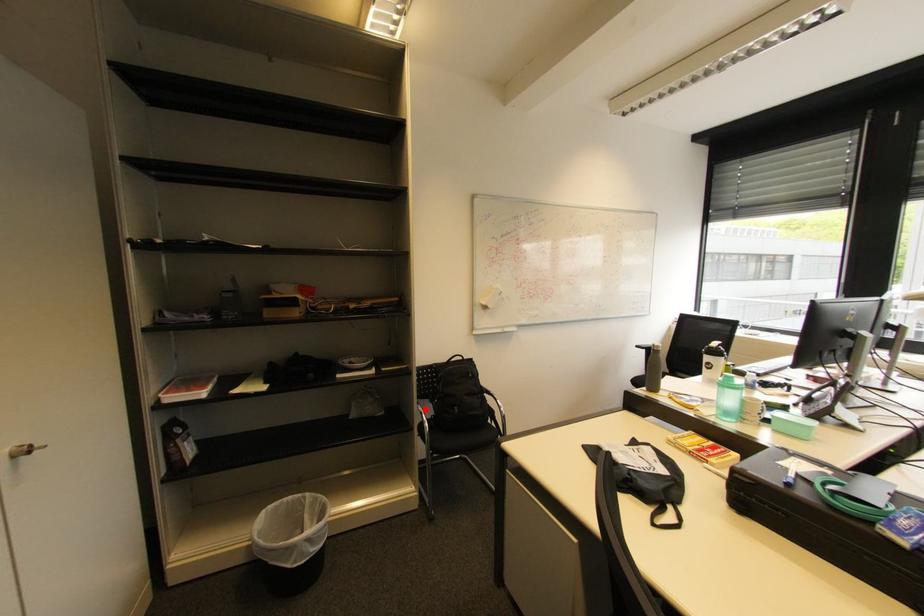
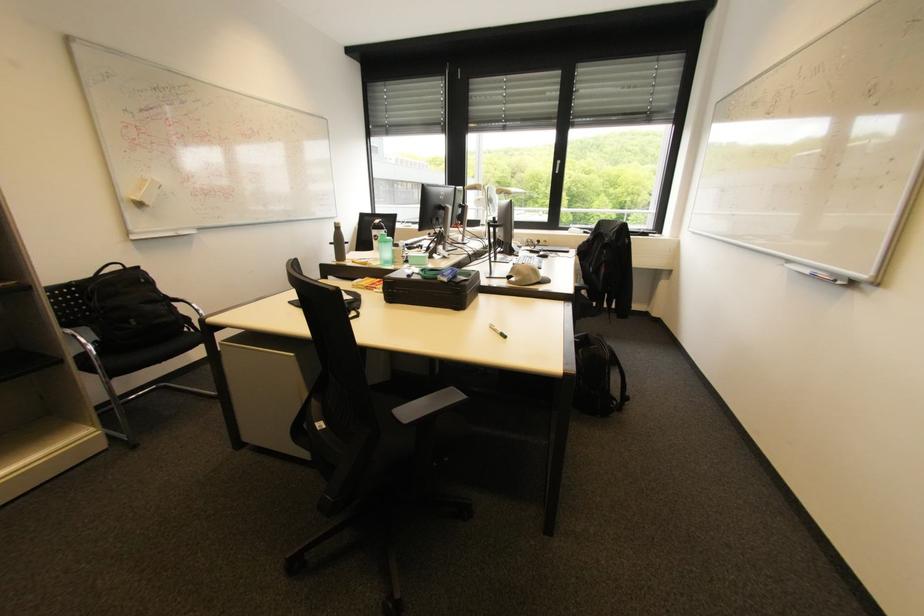
Locate, in the second image, the point that corresponds to the highlighted location in the first image.

(74, 331)